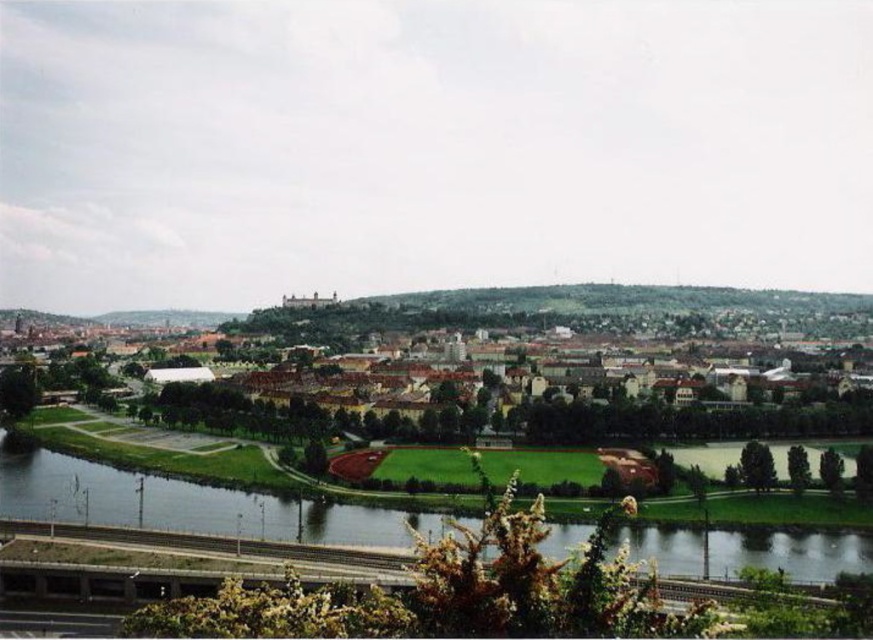
Can you confirm if green grassy field at center is shorter than green grass at lower center?

No, green grassy field at center is not shorter than green grass at lower center.

Between point (511, 362) and point (212, 516), which one is positioned in front?

Point (212, 516) is more forward.

Is point (696, 404) farther from camera compared to point (691, 540)?

Yes, it is.

Locate an element on the screen. green grassy field at center is located at coordinates (524, 365).